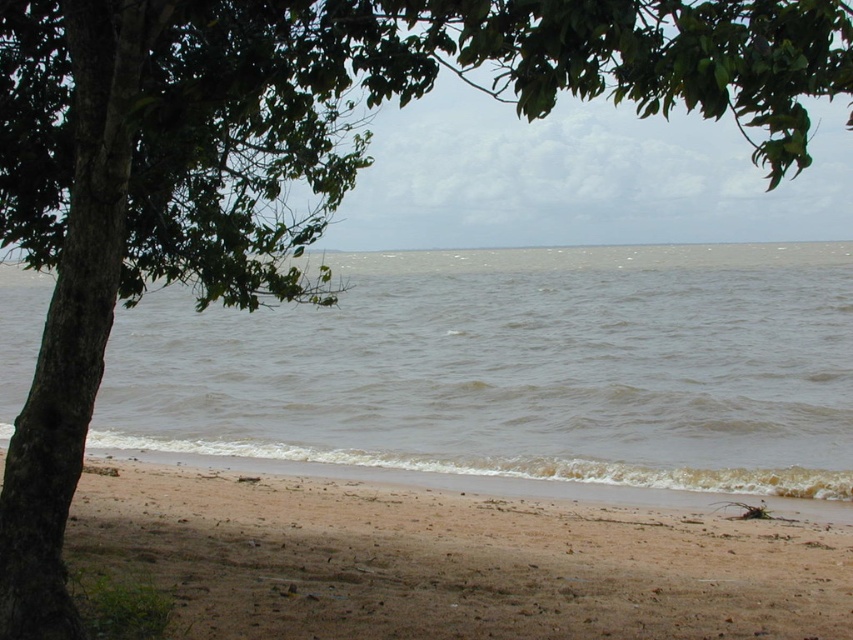
Can you confirm if brown water at lower center is smaller than brown sandy beach at lower center?

No, brown water at lower center is not smaller than brown sandy beach at lower center.

Who is higher up, brown water at lower center or brown sandy beach at lower center?

brown water at lower center is higher up.

Which is in front, point (480, 460) or point (132, 548)?

Point (132, 548) is in front.

You are a GUI agent. You are given a task and a screenshot of the screen. Output one action in this format:
    pyautogui.click(x=<x>, y=<y>)
    Task: Click on the brown water at lower center
    The image size is (853, 640).
    Given the screenshot: What is the action you would take?
    pyautogui.click(x=515, y=374)